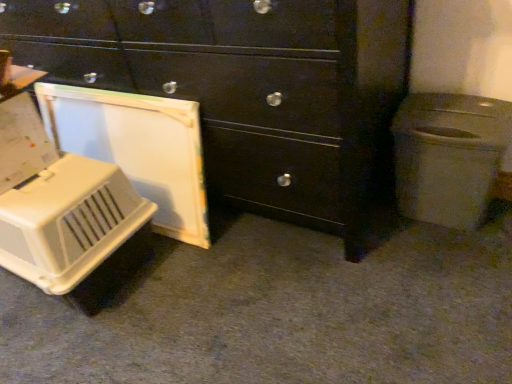
At what (x,y) coordinates should I click in order to perform the action: click on vacant area that is situated to the right of white plastic pet carrier at lower left. Please return your answer as a coordinate pair (x, y). Image resolution: width=512 pixels, height=384 pixels. Looking at the image, I should click on (211, 278).